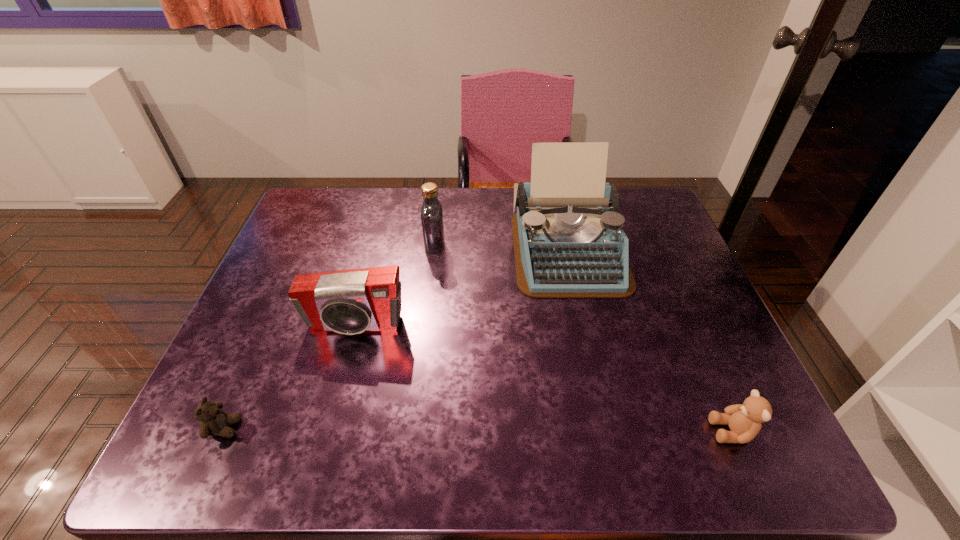
Image resolution: width=960 pixels, height=540 pixels. Identify the location of object that stands as the closest to the second object from right to left. (432, 223).

Identify which object is located as the nearest to the right teddy bear. Please provide its 2D coordinates. Your answer should be formatted as a tuple, i.e. [(x, y)], where the tuple contains the x and y coordinates of a point satisfying the conditions above.

[(568, 240)]

Locate an element on the screen. This screenshot has width=960, height=540. free region that satisfies the following two spatial constraints: 1. on the front-facing side of the camera; 2. on the face of the shortest object is located at coordinates (327, 428).